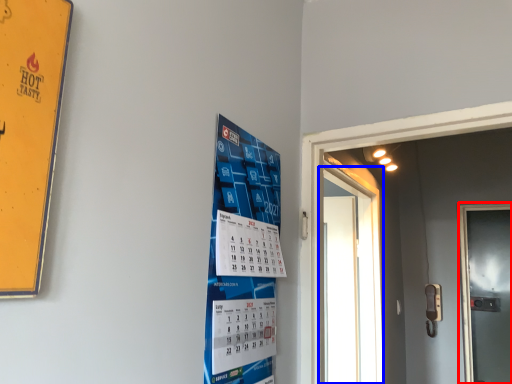
Question: Which object appears farthest to the camera in this image, door (highlighted by a red box) or door (highlighted by a blue box)?

Choices:
 (A) door
 (B) door

Answer: (A)